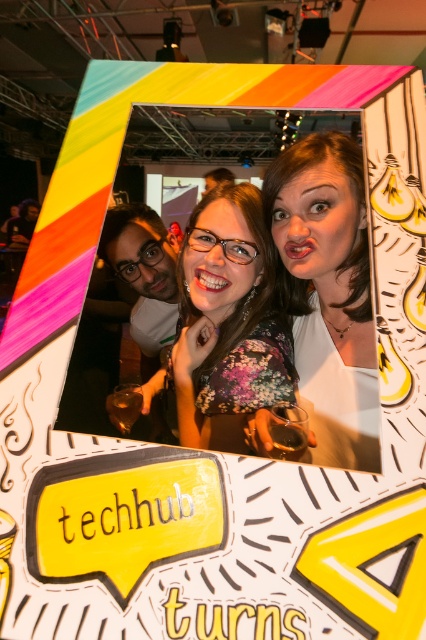
Looking at this image, you are a photographer at the event and want to ensure the matte white face at center is centered in the photo. Based on its current position at point 0.458, 0.770, should you move the camera slightly to the left or right to center it horizontally?

The matte white face at center is already positioned at point 0.458 on the horizontal axis. Since the center of the photo is at 0.5, it is slightly to the left of center. To center it horizontally, move the camera slightly to the right.

You are a photographer at the event and want to ensure both the matte white face at center and the floral fabric dress at center are clearly visible in your photo. Considering their sizes, which one might require more careful framing to avoid being overwhelmed by the other?

The matte white face at center occupies less space than the floral fabric dress at center, so it might require more careful framing to avoid being overwhelmed by the dress.